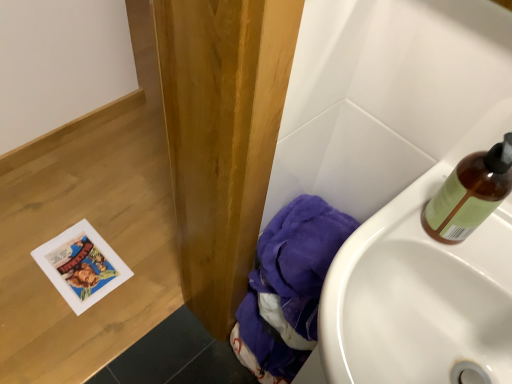
Question: Does white glossy sink at lower right turn towards purple fabric at lower right?

Choices:
 (A) no
 (B) yes

Answer: (A)

Question: Is white glossy sink at lower right behind purple fabric at lower right?

Choices:
 (A) yes
 (B) no

Answer: (B)

Question: Is white glossy sink at lower right next to purple fabric at lower right and touching it?

Choices:
 (A) no
 (B) yes

Answer: (A)

Question: Considering the relative positions of white glossy sink at lower right and purple fabric at lower right in the image provided, is white glossy sink at lower right in front of purple fabric at lower right?

Choices:
 (A) no
 (B) yes

Answer: (B)

Question: From a real-world perspective, is white glossy sink at lower right located higher than purple fabric at lower right?

Choices:
 (A) no
 (B) yes

Answer: (B)

Question: Is purple fabric at lower right inside or outside of translucent amber bottle at upper right?

Choices:
 (A) inside
 (B) outside

Answer: (B)

Question: From the image's perspective, is purple fabric at lower right above or below translucent amber bottle at upper right?

Choices:
 (A) above
 (B) below

Answer: (B)

Question: Considering the positions of purple fabric at lower right and translucent amber bottle at upper right in the image, is purple fabric at lower right taller or shorter than translucent amber bottle at upper right?

Choices:
 (A) short
 (B) tall

Answer: (B)

Question: Relative to translucent amber bottle at upper right, is purple fabric at lower right in front or behind?

Choices:
 (A) front
 (B) behind

Answer: (B)

Question: Would you say white glossy sink at lower right is inside or outside purple fabric at lower right?

Choices:
 (A) inside
 (B) outside

Answer: (B)

Question: Relative to purple fabric at lower right, is white glossy sink at lower right in front or behind?

Choices:
 (A) front
 (B) behind

Answer: (A)

Question: From the image's perspective, is white glossy sink at lower right positioned above or below purple fabric at lower right?

Choices:
 (A) above
 (B) below

Answer: (A)

Question: In terms of size, does white glossy sink at lower right appear bigger or smaller than purple fabric at lower right?

Choices:
 (A) big
 (B) small

Answer: (B)

Question: Considering the positions of point (428, 294) and point (488, 201), is point (428, 294) closer or farther from the camera than point (488, 201)?

Choices:
 (A) farther
 (B) closer

Answer: (A)

Question: Visually, is white glossy sink at lower right positioned to the left or to the right of translucent amber bottle at upper right?

Choices:
 (A) right
 (B) left

Answer: (B)